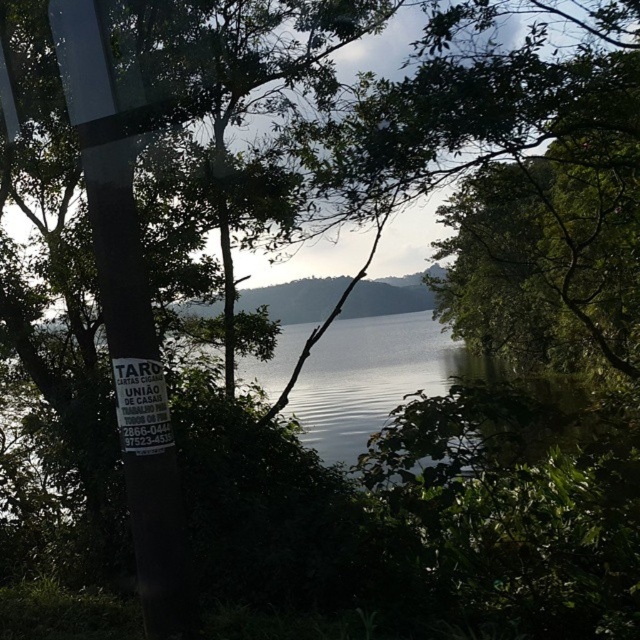
You are a hiker who wants to place a marker between the two points, point (154, 580) and point (163, 410). Based on their positions, which point should the marker be closer to?

The marker should be closer to point (154, 580) because it is in front of point 0.256, so it is closer to the observer.

You are a hiker who just arrived at this natural area and need to locate the trailhead. You see a black plastic pole at left and a white paper sign at left. Which object should you look at first to find trail information?

You should look at the white paper sign at left first because the black plastic pole at left is to the left of it, meaning the sign is closer to your current position on the right side.

Based on the photo, you are a surveyor using a coordinate system where the bottom left corner is the origin. You need to place a marker at the exact location of the black plastic pole at left. What are the coordinates where you should place the marker?

The coordinates for the black plastic pole at left are at point (x=125, y=321).